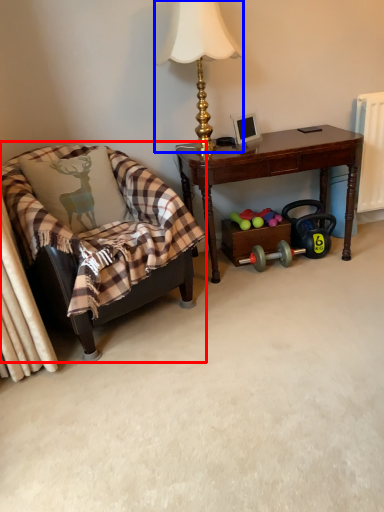
Question: Which object is further to the camera taking this photo, chair (highlighted by a red box) or lamp (highlighted by a blue box)?

Choices:
 (A) chair
 (B) lamp

Answer: (B)